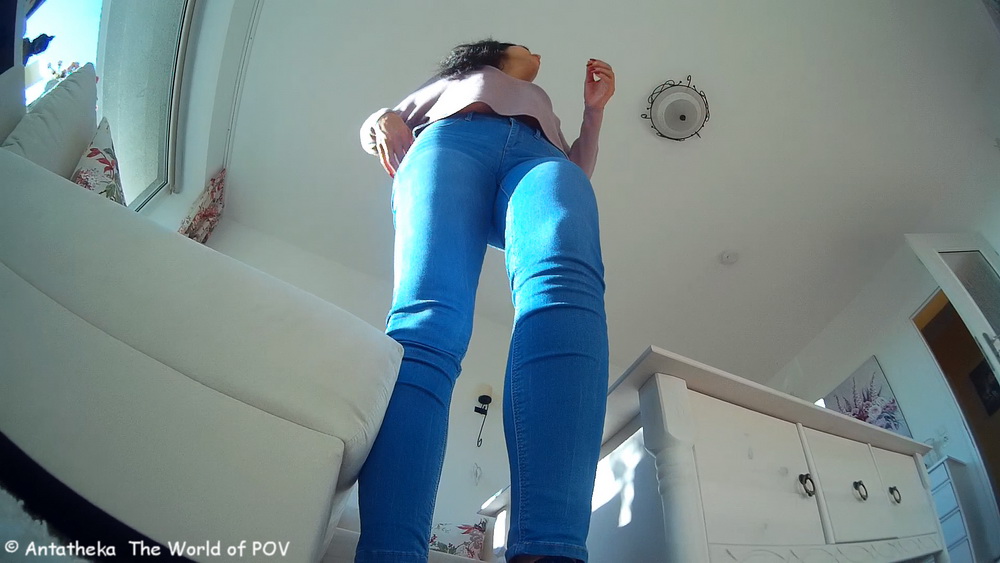
Image resolution: width=1000 pixels, height=563 pixels. Find the location of `handle`. handle is located at coordinates (806, 482), (857, 489), (896, 493).